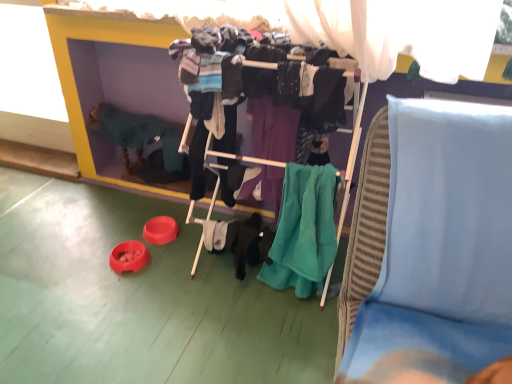
Find the location of `vacant position to the left of teal fabric clothes at center`. vacant position to the left of teal fabric clothes at center is located at coordinates click(155, 285).